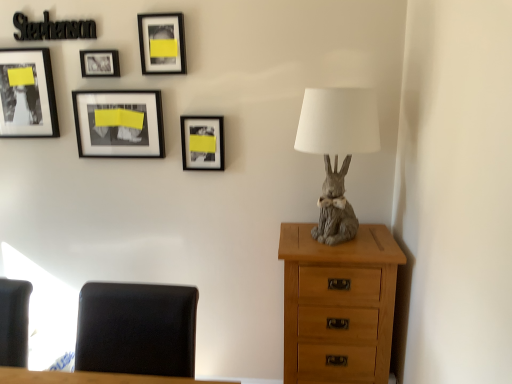
Question: Based on their sizes in the image, would you say light brown wood chest of drawers at right is bigger or smaller than black leather chair at lower left?

Choices:
 (A) big
 (B) small

Answer: (A)

Question: Is light brown wood chest of drawers at right to the left or to the right of black leather chair at lower left in the image?

Choices:
 (A) right
 (B) left

Answer: (A)

Question: Considering the real-world distances, which object is closest to the gray textured rabbit at right?

Choices:
 (A) light brown wood chest of drawers at right
 (B) black leather chair at lower left
 (C) matte black frame at upper left, the fifth picture frame in the right-to-left sequence
 (D) black matte picture frame at upper left, the 3th picture frame from the right
 (E) matte black picture frame at center, which is counted as the fifth picture frame, starting from the left

Answer: (A)

Question: Based on their relative distances, which object is farther from the gray textured rabbit at right?

Choices:
 (A) matte black picture frame at center, which is counted as the fifth picture frame, starting from the left
 (B) matte black frame at upper left, the fifth picture frame in the right-to-left sequence
 (C) black leather chair at lower left
 (D) matte black frame at upper center, which is counted as the 2th picture frame, starting from the right
 (E) light brown wood chest of drawers at right

Answer: (B)